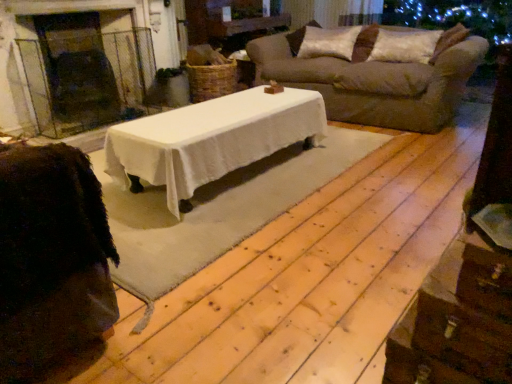
Question: Does silky beige pillow at upper right, the first pillow when ordered from left to right, have a lesser height compared to glass fireplace at left?

Choices:
 (A) no
 (B) yes

Answer: (B)

Question: From a real-world perspective, does silky beige pillow at upper right, which is counted as the 2th pillow, starting from the right, stand above glass fireplace at left?

Choices:
 (A) yes
 (B) no

Answer: (A)

Question: Is glass fireplace at left inside silky beige pillow at upper right, which is counted as the 2th pillow, starting from the right?

Choices:
 (A) yes
 (B) no

Answer: (B)

Question: Can you confirm if silky beige pillow at upper right, the first pillow when ordered from left to right, is smaller than glass fireplace at left?

Choices:
 (A) yes
 (B) no

Answer: (A)

Question: Does silky beige pillow at upper right, which is counted as the 2th pillow, starting from the right, have a lesser width compared to glass fireplace at left?

Choices:
 (A) no
 (B) yes

Answer: (B)

Question: In terms of width, does silky beige pillow at upper right, the first pillow when ordered from left to right, look wider or thinner when compared to brown fabric sofa at upper right?

Choices:
 (A) wide
 (B) thin

Answer: (B)

Question: Considering the relative positions of silky beige pillow at upper right, which is counted as the 2th pillow, starting from the right, and brown fabric sofa at upper right in the image provided, is silky beige pillow at upper right, which is counted as the 2th pillow, starting from the right, to the left or to the right of brown fabric sofa at upper right?

Choices:
 (A) right
 (B) left

Answer: (B)

Question: Considering the positions of silky beige pillow at upper right, the first pillow when ordered from left to right, and brown fabric sofa at upper right in the image, is silky beige pillow at upper right, the first pillow when ordered from left to right, taller or shorter than brown fabric sofa at upper right?

Choices:
 (A) tall
 (B) short

Answer: (B)

Question: Is silky beige pillow at upper right, the first pillow when ordered from left to right, inside or outside of brown fabric sofa at upper right?

Choices:
 (A) inside
 (B) outside

Answer: (A)

Question: Considering the positions of brown fabric sofa at upper right and silky beige pillow at upper right, the first pillow when ordered from left to right, in the image, is brown fabric sofa at upper right bigger or smaller than silky beige pillow at upper right, the first pillow when ordered from left to right,?

Choices:
 (A) small
 (B) big

Answer: (B)

Question: Relative to silky beige pillow at upper right, the first pillow when ordered from left to right, is brown fabric sofa at upper right in front or behind?

Choices:
 (A) behind
 (B) front

Answer: (B)

Question: Considering the positions of brown fabric sofa at upper right and silky beige pillow at upper right, the first pillow when ordered from left to right, in the image, is brown fabric sofa at upper right taller or shorter than silky beige pillow at upper right, the first pillow when ordered from left to right,?

Choices:
 (A) tall
 (B) short

Answer: (A)

Question: In terms of width, does brown fabric sofa at upper right look wider or thinner when compared to silky beige pillow at upper right, the first pillow when ordered from left to right?

Choices:
 (A) wide
 (B) thin

Answer: (A)

Question: Relative to velvet brown pillow at upper right, the second pillow from the left, is glass fireplace at left in front or behind?

Choices:
 (A) behind
 (B) front

Answer: (B)

Question: Based on their sizes in the image, would you say glass fireplace at left is bigger or smaller than velvet brown pillow at upper right, the second pillow from the left?

Choices:
 (A) small
 (B) big

Answer: (B)